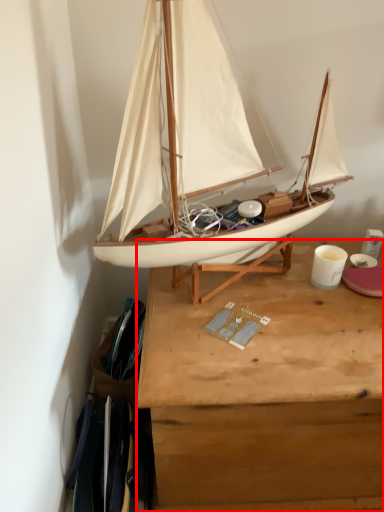
Question: Observing the image, what is the correct spatial positioning of desk (annotated by the red box) in reference to boat?

Choices:
 (A) right
 (B) left

Answer: (A)